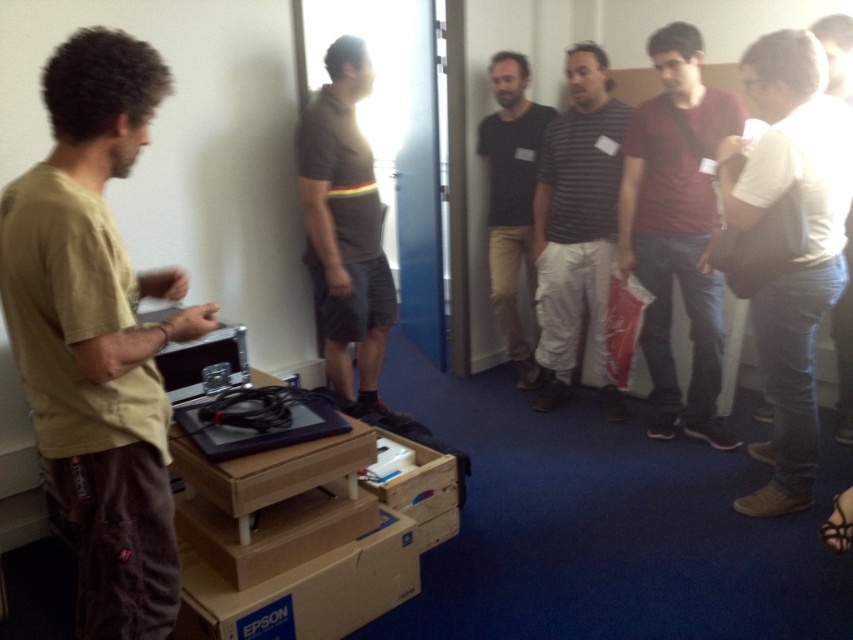
Question: From the image, what is the correct spatial relationship of brown cardboard box at lower center in relation to wooden crate at center?

Choices:
 (A) right
 (B) left

Answer: (B)

Question: Does dark gray t-shirt at center appear over black cotton shirt at center?

Choices:
 (A) no
 (B) yes

Answer: (A)

Question: Which point is farther from the camera taking this photo?

Choices:
 (A) (519, 60)
 (B) (454, 456)
 (C) (387, 307)

Answer: (A)

Question: Which object appears farthest from the camera in this image?

Choices:
 (A) wooden crate at center
 (B) dark gray t-shirt at center

Answer: (B)

Question: Which point is closer to the camera?

Choices:
 (A) (670, 352)
 (B) (566, 380)

Answer: (A)

Question: Is khaki cotton t-shirt at left to the right of striped cotton shirt at center from the viewer's perspective?

Choices:
 (A) yes
 (B) no

Answer: (B)